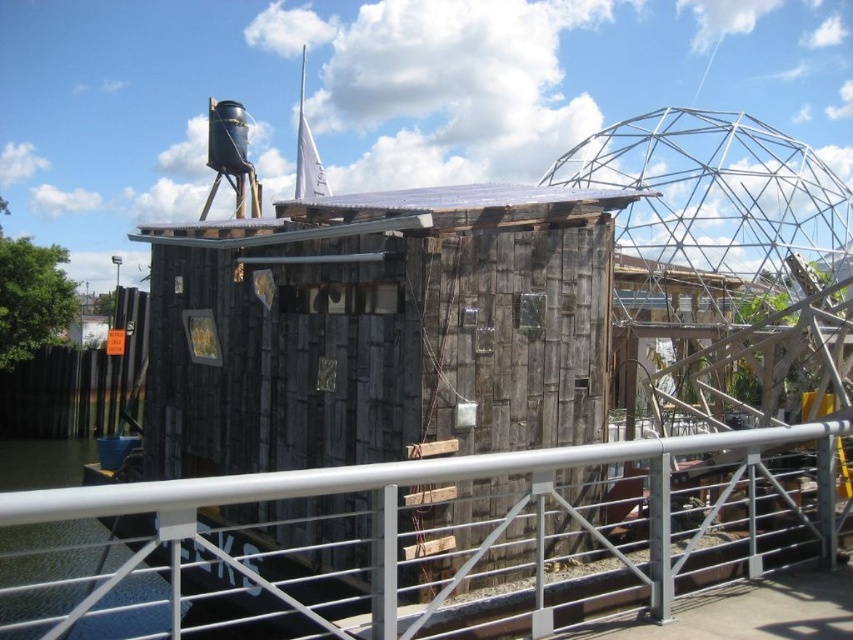
Is point (178, 280) in front of point (32, 502)?

No, it is behind (32, 502).

Does weathered wood hut at center have a greater width compared to silver metallic rail at lower center?

Yes.

Find the location of a particular element. Image resolution: width=853 pixels, height=640 pixels. weathered wood hut at center is located at coordinates (379, 330).